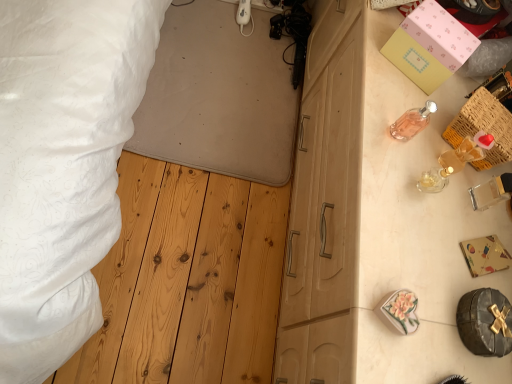
Find the location of `free space behind pink glass perfume at upper right`. free space behind pink glass perfume at upper right is located at coordinates (406, 84).